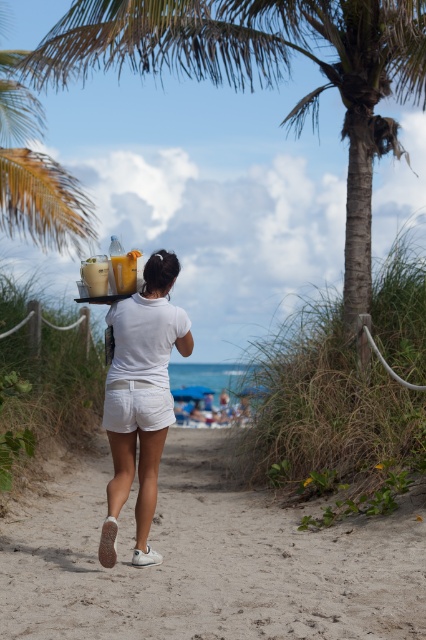
Based on the beach scene described, which object is positioned higher relative to the other between the white matte shorts at center and the dark brown hair at upper center?

The white matte shorts at center is taller than the dark brown hair at upper center.

You are a photographer trying to capture the person in the scene. Given that the white matte shorts at center and the dark brown hair at upper center are both in your viewfinder, which object would appear bigger in the photo?

The white matte shorts at center would appear bigger in the photo since it has a larger size compared to the dark brown hair at upper center according to the description.

You are a photographer positioned at the beach scene. You notice the green leafy palm tree at center and the white matte shorts at center. Which object is higher in the image?

The green leafy palm tree at center is above the white matte shorts at center, so the palm tree is higher in the image.